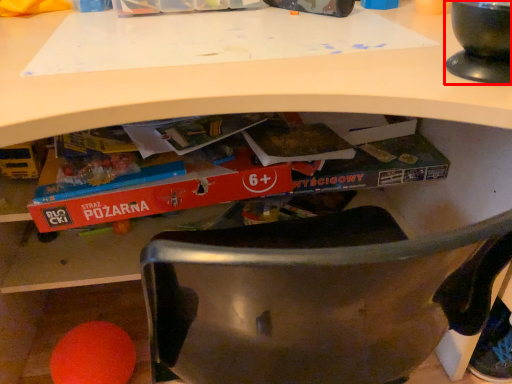
Question: Where is appliance (annotated by the red box) located in relation to paperback book in the image?

Choices:
 (A) left
 (B) right

Answer: (B)